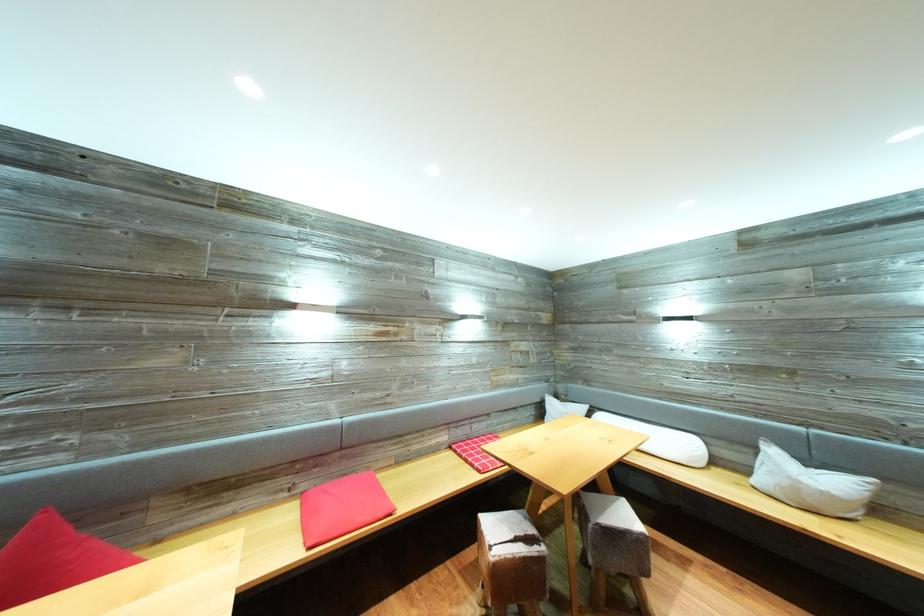
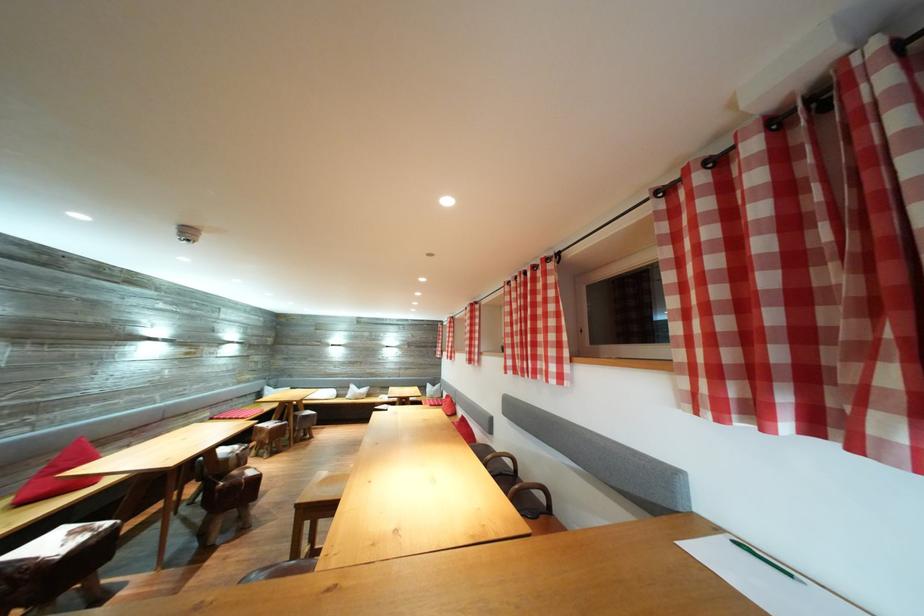
Question: I am providing you with two images of the same scene from different viewpoints. After the viewpoint changes to image2, which objects are now occluded?

Choices:
 (A) red triangular pillow
 (B) sofa sitting surface
 (C) chair sitting surface
 (D) none of these

Answer: (D)